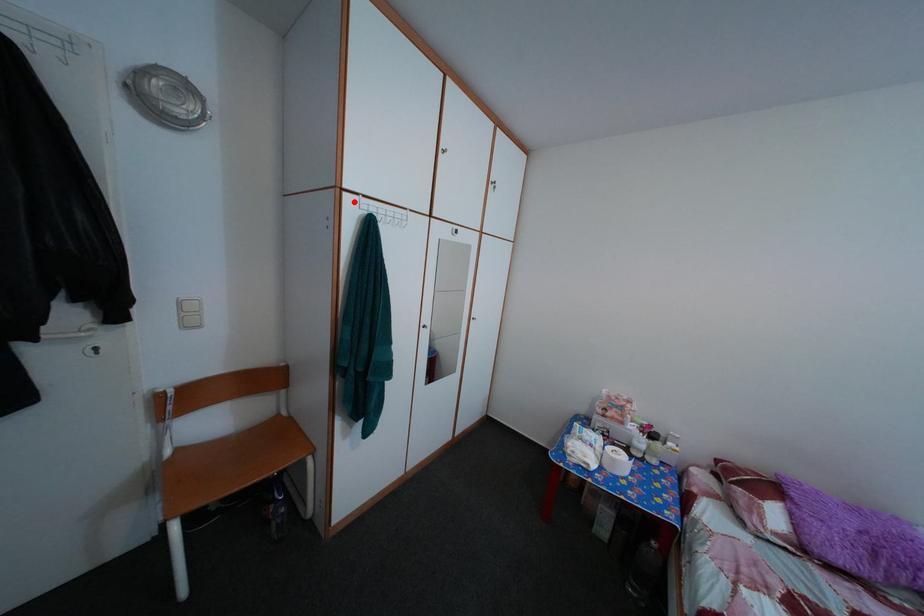
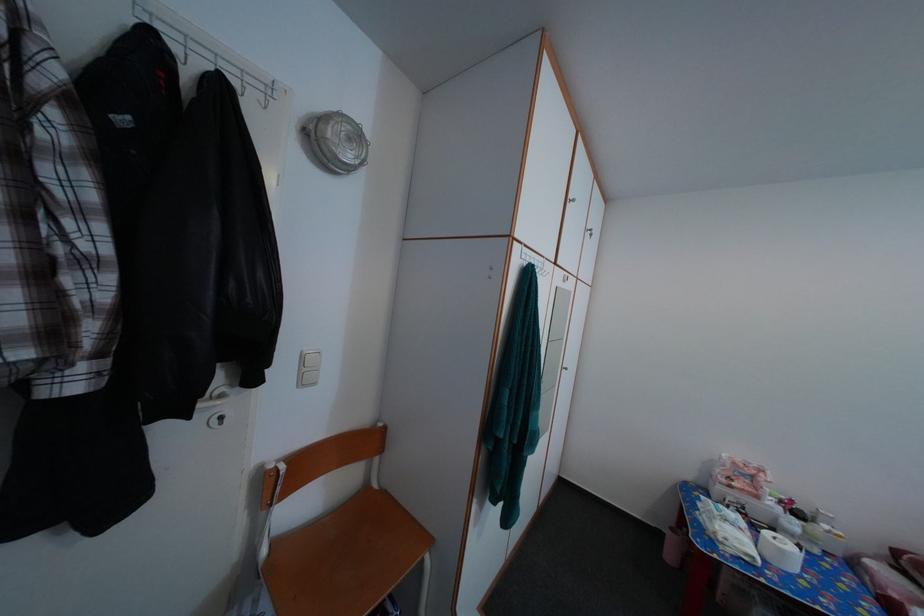
The point at the highlighted location is marked in the first image. Where is the corresponding point in the second image?

(525, 251)